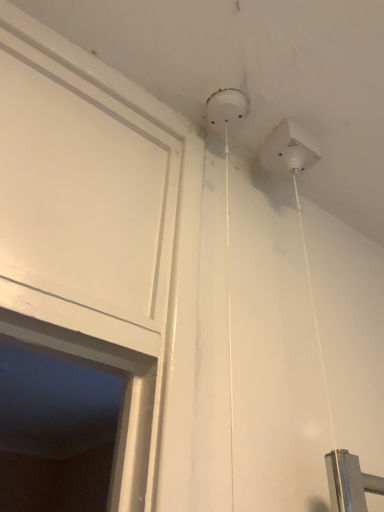
Locate an element on the screen. The image size is (384, 512). white plastic sensor at upper center is located at coordinates (289, 152).

What is the approximate width of white plastic sensor at upper center?

It is 5.55 inches.

This screenshot has width=384, height=512. Describe the element at coordinates (289, 152) in the screenshot. I see `white plastic sensor at upper center` at that location.

Locate an element on the screen. The image size is (384, 512). white plastic sensor at upper center is located at coordinates (289, 152).